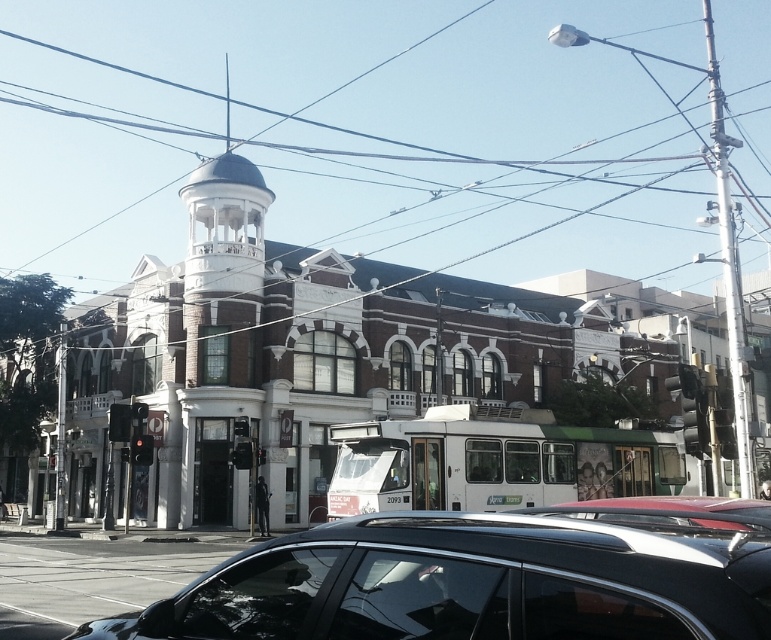
Between point (310, 576) and point (699, 522), which one is positioned in front?

Point (310, 576) is more forward.

Identify the location of black glossy car at lower center. Image resolution: width=771 pixels, height=640 pixels. (480, 580).

Identify the location of black glossy car at lower center. The image size is (771, 640). (480, 580).

Between black glossy car at lower center and white matte bus at center, which one is positioned lower?

white matte bus at center is below.

Can you confirm if black glossy car at lower center is smaller than white matte bus at center?

Correct, black glossy car at lower center occupies less space than white matte bus at center.

Who is more forward, (556, 628) or (583, 476)?

Point (556, 628) is more forward.

The height and width of the screenshot is (640, 771). Identify the location of black glossy car at lower center. (480, 580).

Which is behind, point (513, 445) or point (687, 513)?

The point (513, 445) is behind.

Does white matte bus at center have a larger size compared to metallic silver car at lower center?

Incorrect, white matte bus at center is not larger than metallic silver car at lower center.

The image size is (771, 640). Describe the element at coordinates (493, 461) in the screenshot. I see `white matte bus at center` at that location.

At what (x,y) coordinates should I click in order to perform the action: click on white matte bus at center. Please return your answer as a coordinate pair (x, y). Looking at the image, I should click on (493, 461).